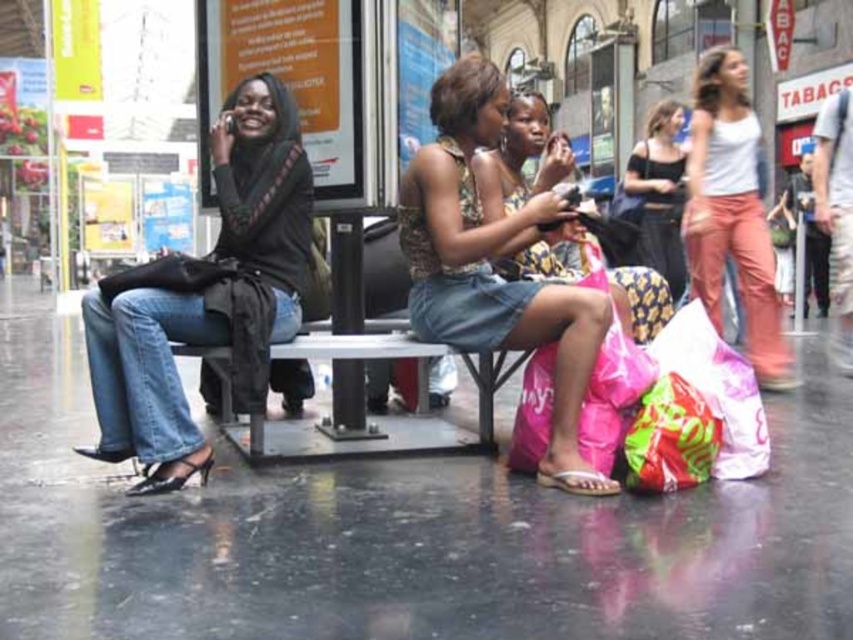
Question: Among these objects, which one is farthest from the camera?

Choices:
 (A) white cotton tank top at upper right
 (B) matte black tank top at upper right

Answer: (B)

Question: Is matte black jacket at left behind denim skirt at center?

Choices:
 (A) no
 (B) yes

Answer: (A)

Question: Does white cotton tank top at upper right come in front of metallic gray bench at center?

Choices:
 (A) no
 (B) yes

Answer: (A)

Question: Estimate the real-world distances between objects in this image. Which object is closer to the patterned fabric dress at center?

Choices:
 (A) denim skirt at center
 (B) metallic gray bench at center
 (C) matte black jacket at left
 (D) matte black tank top at upper right

Answer: (A)

Question: Which of the following is the closest to the observer?

Choices:
 (A) white cotton tank top at upper right
 (B) metallic gray bench at center
 (C) matte black tank top at upper right

Answer: (B)

Question: Observing the image, what is the correct spatial positioning of white cotton tank top at upper right in reference to patterned fabric dress at center?

Choices:
 (A) below
 (B) above

Answer: (B)